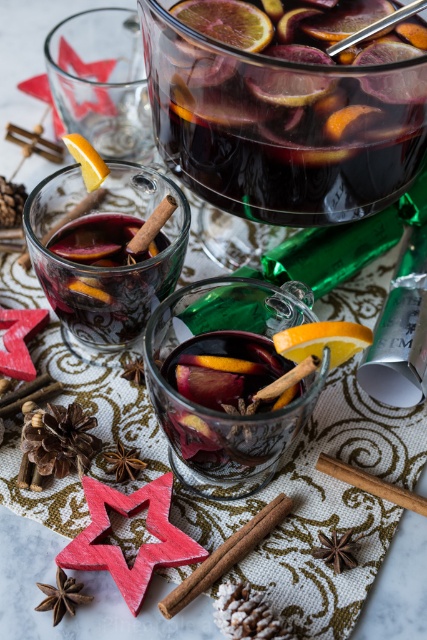
You are at a holiday party and want to grab an orange slice from the pitcher. Which orange is easier to reach, the orangesmoothslice at center or the yellow matte orange at center?

The orangesmoothslice at center is closer to the viewer than the yellow matte orange at center, so it is easier to reach.

You are setting up a holiday drink station and need to place a small cinnamon stick between the orangesmoothslice at center and the orangesmoothorange slice at upper center. The cinnamon stick is 2.5 inches long. Will it fit between them?

The distance between the orangesmoothslice at center and the orangesmoothorange slice at upper center is 3.19 inches, which is greater than the cinnamon stick length of 2.5 inches. Therefore, the cinnamon stick will fit between them.

You are a guest at a holiday party holding a small wooden spoon that is 15 centimeters long. You want to reach the orangesmoothslice at center in the glass pitcher to taste the drink. Can your spoon reach it?

The orangesmoothslice at center is 22.81 centimeters away from you. Since your spoon is only 15 centimeters long, it cannot reach the orangesmoothslice at center.